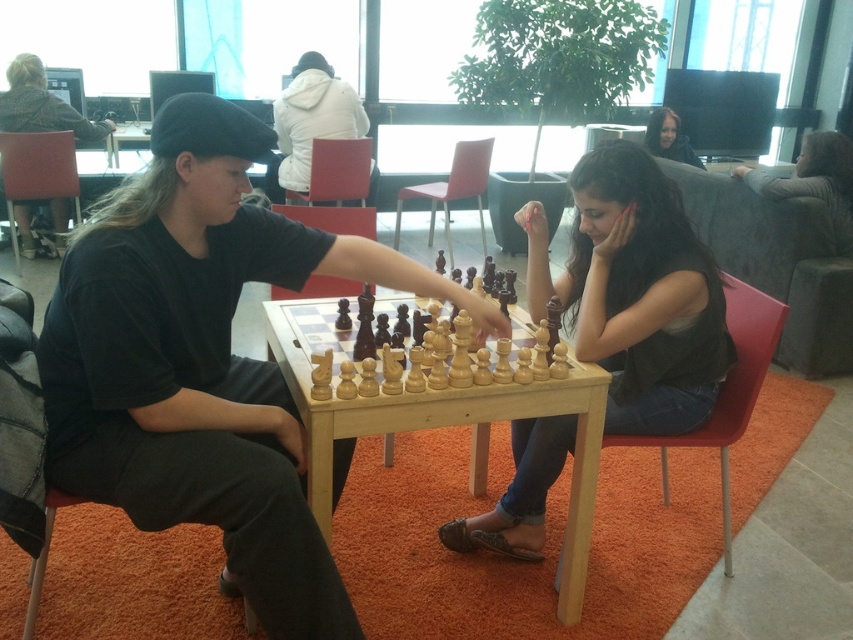
Is matte black shirt at center taller than white matte jacket at upper center?

Indeed, matte black shirt at center has a greater height compared to white matte jacket at upper center.

From the picture: Which is more to the right, matte black shirt at center or white matte jacket at upper center?

matte black shirt at center is more to the right.

This screenshot has height=640, width=853. What do you see at coordinates (202, 362) in the screenshot?
I see `matte black shirt at center` at bounding box center [202, 362].

Where is `matte black shirt at center`? The height and width of the screenshot is (640, 853). matte black shirt at center is located at coordinates (202, 362).

Consider the image. Is matte black shirt at center shorter than black cotton shirt at left?

Incorrect, matte black shirt at center's height does not fall short of black cotton shirt at left's.

Is matte black shirt at center above black cotton shirt at left?

No, matte black shirt at center is not above black cotton shirt at left.

This screenshot has width=853, height=640. I want to click on matte black shirt at center, so (202, 362).

Image resolution: width=853 pixels, height=640 pixels. Find the location of `matte black shirt at center`. matte black shirt at center is located at coordinates (202, 362).

Can you confirm if matte black shirt at center is positioned to the left of matte black hair at upper center?

Correct, you'll find matte black shirt at center to the left of matte black hair at upper center.

Locate an element on the screen. Image resolution: width=853 pixels, height=640 pixels. matte black shirt at center is located at coordinates (202, 362).

Does point (213, 429) come in front of point (670, 112)?

Yes, it is.

Locate an element on the screen. Image resolution: width=853 pixels, height=640 pixels. matte black shirt at center is located at coordinates (202, 362).